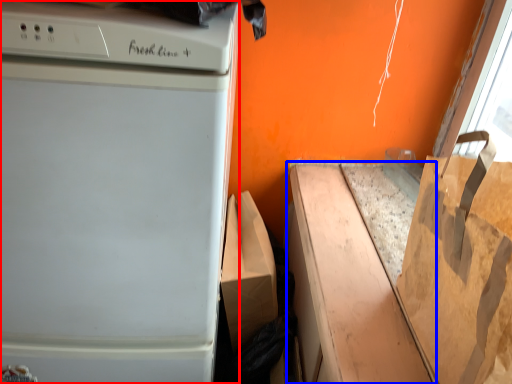
Question: Which point is closer to the camera, home appliance (highlighted by a red box) or cardboard box (highlighted by a blue box)?

Choices:
 (A) home appliance
 (B) cardboard box

Answer: (A)